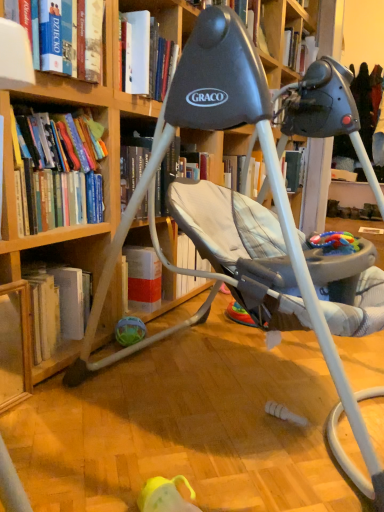
Question: From a real-world perspective, is translucent plastic ball at lower center, which ranks as the second toy in right-to-left order, physically above hardcover book at upper left, which is the 1th book in top-to-bottom order?

Choices:
 (A) yes
 (B) no

Answer: (B)

Question: Is translucent plastic ball at lower center, acting as the 2th toy starting from the top, aimed at hardcover book at upper left, which is the 1th book in top-to-bottom order?

Choices:
 (A) yes
 (B) no

Answer: (B)

Question: Is hardcover book at upper left, arranged as the 2th book when ordered from the bottom, a part of translucent plastic ball at lower center, the 1th toy positioned from the left?

Choices:
 (A) yes
 (B) no

Answer: (B)

Question: Considering the relative sizes of translucent plastic ball at lower center, which is counted as the first toy, starting from the bottom, and hardcover book at upper left, arranged as the 2th book when ordered from the bottom, in the image provided, is translucent plastic ball at lower center, which is counted as the first toy, starting from the bottom, smaller than hardcover book at upper left, arranged as the 2th book when ordered from the bottom,?

Choices:
 (A) no
 (B) yes

Answer: (B)

Question: Is translucent plastic ball at lower center, the first toy positioned from the back, taller than hardcover book at upper left, which is the 1th book in top-to-bottom order?

Choices:
 (A) yes
 (B) no

Answer: (B)

Question: Can you confirm if translucent plastic ball at lower center, marked as the 2th toy in a front-to-back arrangement, is thinner than hardcover book at upper left, which is the 1th book in top-to-bottom order?

Choices:
 (A) no
 (B) yes

Answer: (B)

Question: Would you say wooden bookcase at center is outside hardcover book at upper left, which is the 1th book in top-to-bottom order?

Choices:
 (A) yes
 (B) no

Answer: (A)

Question: From the image's perspective, is wooden bookcase at center above hardcover book at upper left, arranged as the 2th book when ordered from the bottom?

Choices:
 (A) no
 (B) yes

Answer: (A)

Question: From a real-world perspective, is wooden bookcase at center below hardcover book at upper left, which is the 1th book in top-to-bottom order?

Choices:
 (A) yes
 (B) no

Answer: (A)

Question: Is hardcover book at upper left, which is the 1th book in top-to-bottom order, located within wooden bookcase at center?

Choices:
 (A) yes
 (B) no

Answer: (B)

Question: Is wooden bookcase at center in contact with hardcover book at upper left, which is the 1th book in top-to-bottom order?

Choices:
 (A) no
 (B) yes

Answer: (A)

Question: From the image's perspective, is wooden bookcase at center beneath hardcover book at upper left, arranged as the 2th book when ordered from the bottom?

Choices:
 (A) yes
 (B) no

Answer: (A)

Question: From the image's perspective, is hardcover books at left, arranged as the second book when viewed from the top, above wooden bookcase at center?

Choices:
 (A) no
 (B) yes

Answer: (B)